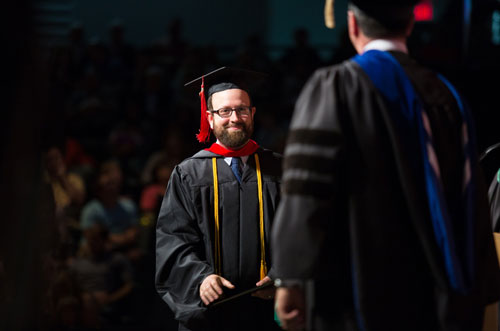
This screenshot has width=500, height=331. What are the coordinates of `red tassel` in the screenshot? It's located at (201, 111).